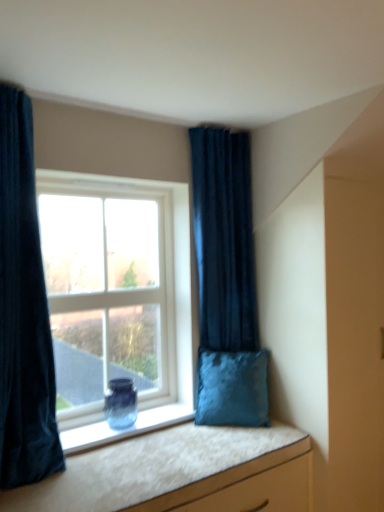
Question: From the image's perspective, would you say white textured vanity at lower right is shown under blue glass vase at window?

Choices:
 (A) yes
 (B) no

Answer: (A)

Question: Is white textured vanity at lower right next to blue glass vase at window and touching it?

Choices:
 (A) no
 (B) yes

Answer: (A)

Question: Does white textured vanity at lower right have a greater height compared to blue glass vase at window?

Choices:
 (A) yes
 (B) no

Answer: (B)

Question: From the image's perspective, is white textured vanity at lower right above blue glass vase at window?

Choices:
 (A) no
 (B) yes

Answer: (A)

Question: Can you confirm if white textured vanity at lower right is wider than blue glass vase at window?

Choices:
 (A) no
 (B) yes

Answer: (B)

Question: Is velvety blue cushion at right inside the boundaries of velvet dark blue curtain at left, the 1th curtain viewed from the front, or outside?

Choices:
 (A) inside
 (B) outside

Answer: (B)

Question: Is velvety blue cushion at right to the left or to the right of velvet dark blue curtain at left, the 1th curtain viewed from the front, in the image?

Choices:
 (A) left
 (B) right

Answer: (B)

Question: Considering the positions of velvety blue cushion at right and velvet dark blue curtain at left, acting as the first curtain starting from the left, in the image, is velvety blue cushion at right taller or shorter than velvet dark blue curtain at left, acting as the first curtain starting from the left,?

Choices:
 (A) short
 (B) tall

Answer: (A)

Question: Is velvety blue cushion at right bigger or smaller than velvet dark blue curtain at left, the 1th curtain viewed from the front?

Choices:
 (A) small
 (B) big

Answer: (A)

Question: From a real-world perspective, is velvety blue cushion at right physically located above or below clear glass window at center?

Choices:
 (A) above
 (B) below

Answer: (B)

Question: In terms of width, does velvety blue cushion at right look wider or thinner when compared to clear glass window at center?

Choices:
 (A) wide
 (B) thin

Answer: (A)

Question: In terms of size, does velvety blue cushion at right appear bigger or smaller than clear glass window at center?

Choices:
 (A) small
 (B) big

Answer: (A)

Question: Considering the relative positions of velvety blue cushion at right and clear glass window at center in the image provided, is velvety blue cushion at right to the left or to the right of clear glass window at center?

Choices:
 (A) left
 (B) right

Answer: (B)

Question: From the image's perspective, is white textured vanity at lower right above or below velvet dark blue curtain at left, the 1th curtain viewed from the front?

Choices:
 (A) below
 (B) above

Answer: (A)

Question: Relative to velvet dark blue curtain at left, placed as the second curtain when sorted from right to left, is white textured vanity at lower right in front or behind?

Choices:
 (A) front
 (B) behind

Answer: (A)